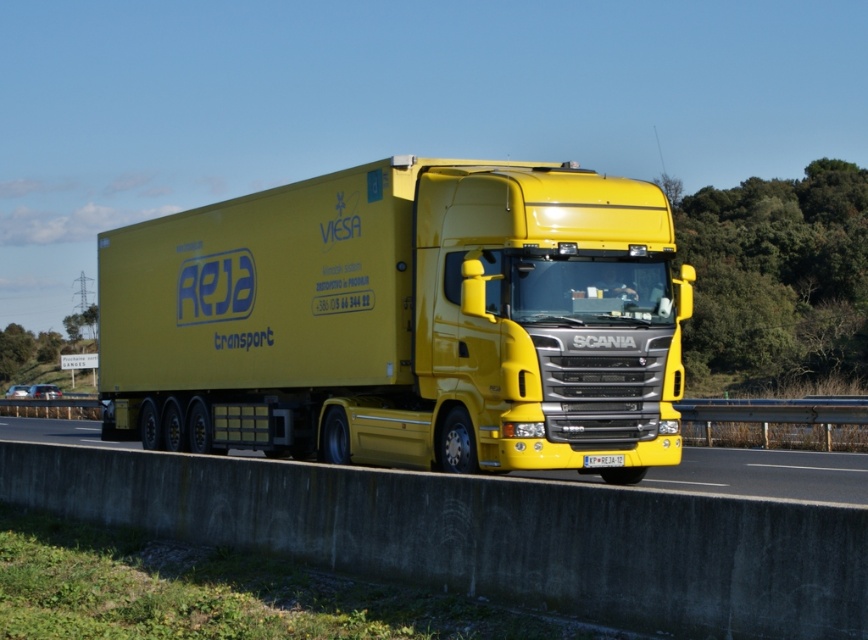
In the scene shown: Is yellow matte truck at center wider than yellow glossy concrete barrier at lower center?

No, yellow matte truck at center is not wider than yellow glossy concrete barrier at lower center.

Is yellow matte truck at center smaller than yellow glossy concrete barrier at lower center?

Yes, yellow matte truck at center is smaller than yellow glossy concrete barrier at lower center.

What are the coordinates of `yellow matte truck at center` in the screenshot? It's located at (404, 321).